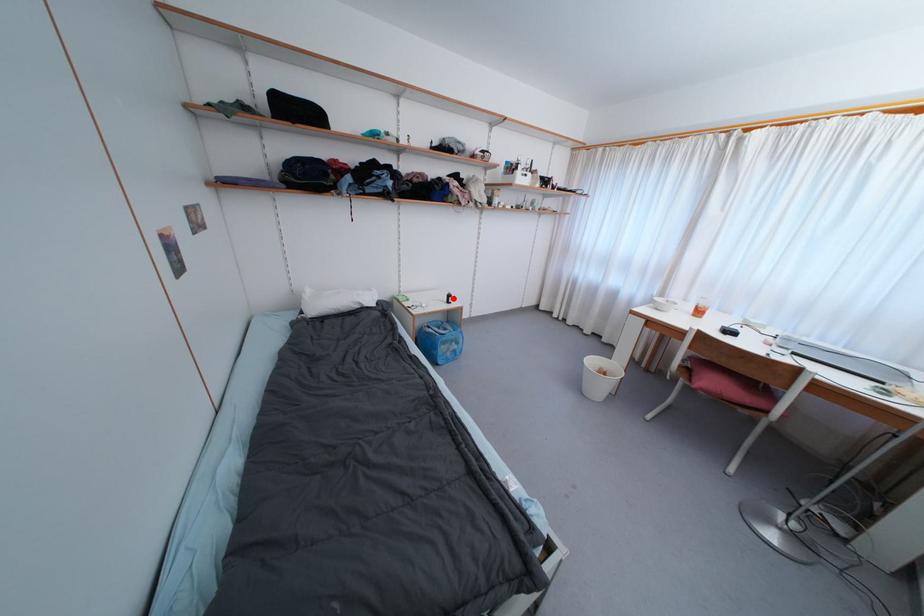
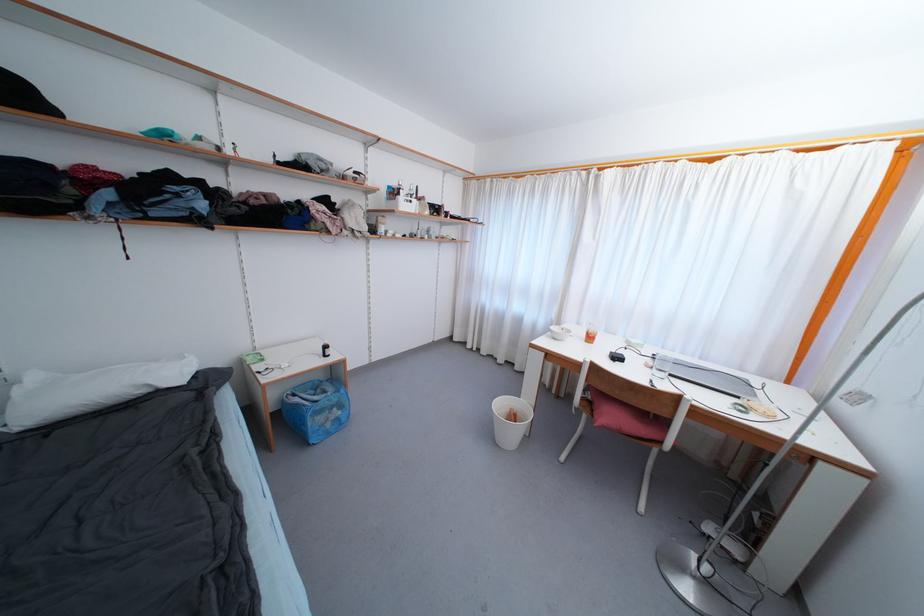
Question: I am providing you with two images of the same scene from different viewpoints. A red point is shown in image1. For the corresponding object point in image2, is it positioned nearer or farther from the camera?

Choices:
 (A) Nearer
 (B) Farther

Answer: (A)